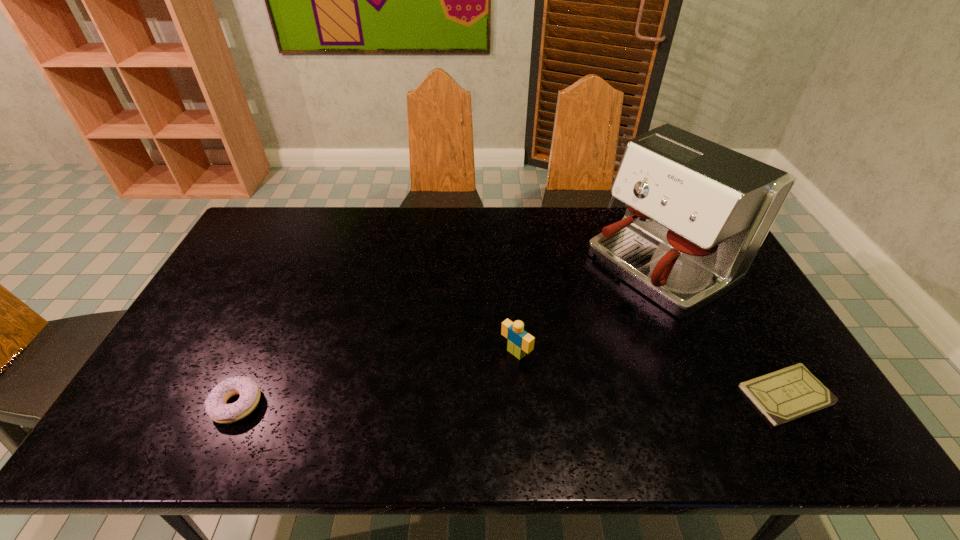
Where is `unoccupied area between the second object from left to right and the checkbook`? unoccupied area between the second object from left to right and the checkbook is located at coordinates [x=651, y=374].

Locate an element on the screen. This screenshot has width=960, height=540. free spot between the shortest object and the third object from right to left is located at coordinates (651, 374).

Identify the location of vacant space in between the third object from right to left and the doughnut. This screenshot has height=540, width=960. (376, 379).

The height and width of the screenshot is (540, 960). Find the location of `empty space between the farthest object and the checkbook`. empty space between the farthest object and the checkbook is located at coordinates (722, 330).

This screenshot has width=960, height=540. I want to click on vacant point located between the shortest object and the coffee maker, so click(722, 330).

Locate an element on the screen. The width and height of the screenshot is (960, 540). object that can be found as the closest to the doughnut is located at coordinates (520, 342).

Where is `object that is the closest to the checkbook`? This screenshot has height=540, width=960. object that is the closest to the checkbook is located at coordinates (697, 213).

Find the location of `vacant space that satisfies the following two spatial constraints: 1. on the front side of the tallest object; 2. on the left side of the shortest object`. vacant space that satisfies the following two spatial constraints: 1. on the front side of the tallest object; 2. on the left side of the shortest object is located at coordinates (716, 395).

At what (x,y) coordinates should I click in order to perform the action: click on vacant space that satisfies the following two spatial constraints: 1. on the back side of the second farthest object; 2. on the left side of the tallest object. Please return your answer as a coordinate pair (x, y). The height and width of the screenshot is (540, 960). Looking at the image, I should click on (510, 265).

Locate an element on the screen. Image resolution: width=960 pixels, height=540 pixels. vacant space that satisfies the following two spatial constraints: 1. on the front side of the checkbook; 2. on the left side of the farthest object is located at coordinates (716, 395).